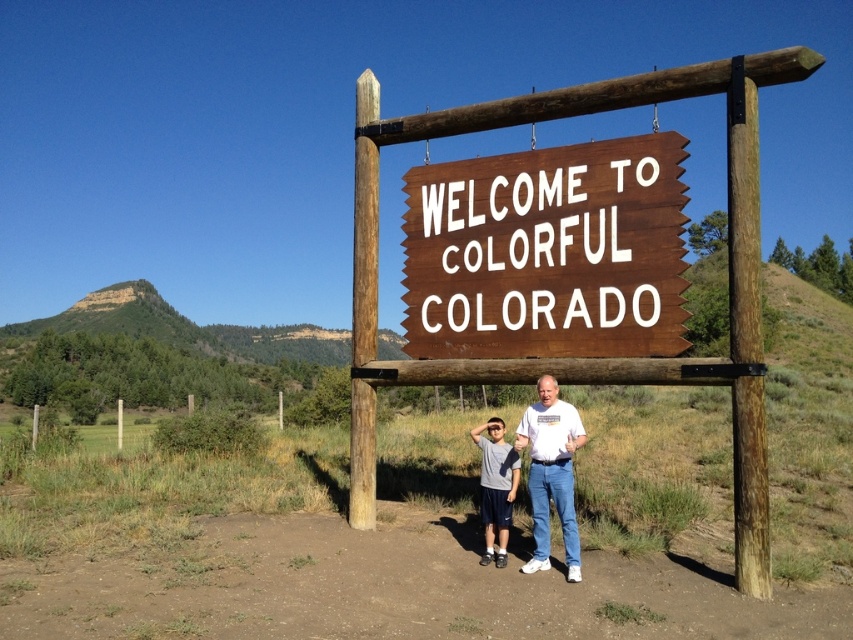
Question: Which object is positioned farthest from the wooden sign at center?

Choices:
 (A) matte gray t-shirt at center
 (B) white t-shirt at center

Answer: (A)

Question: Does wooden sign at center lie behind matte gray t-shirt at center?

Choices:
 (A) no
 (B) yes

Answer: (A)

Question: Is white t-shirt at center above matte gray t-shirt at center?

Choices:
 (A) no
 (B) yes

Answer: (B)

Question: Does wooden sign at center have a lesser width compared to matte gray t-shirt at center?

Choices:
 (A) no
 (B) yes

Answer: (A)

Question: Which point is farther to the camera?

Choices:
 (A) white t-shirt at center
 (B) wooden sign at center
 (C) matte gray t-shirt at center

Answer: (C)

Question: Which point is closer to the camera?

Choices:
 (A) white t-shirt at center
 (B) wooden sign at center

Answer: (A)